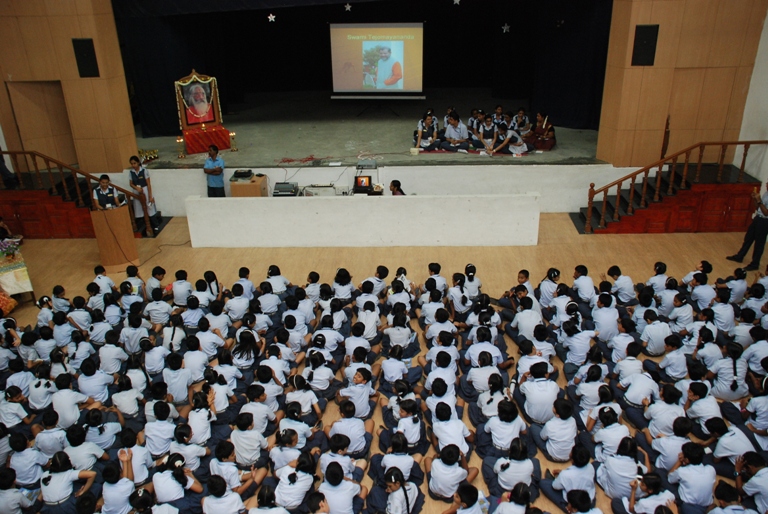
Identify the location of door. (50, 114).